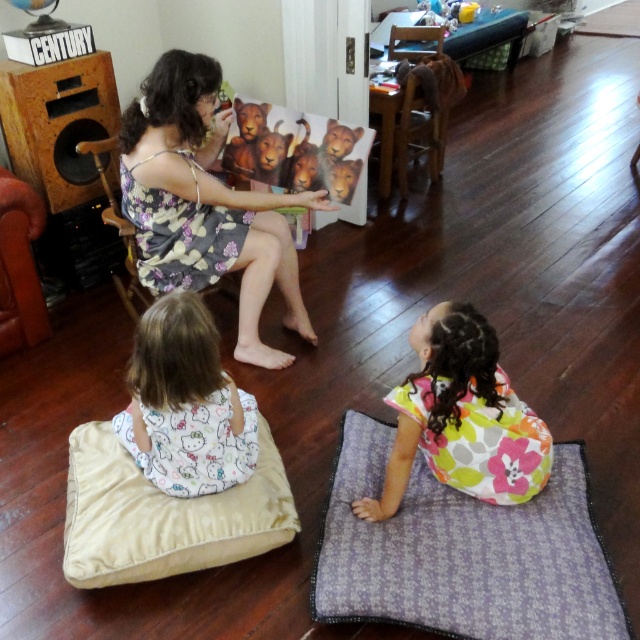
Which is in front, point (513, 547) or point (244, 332)?

Point (513, 547)

Is purple fabric mat at lower right to the right of floral dress at upper center from the viewer's perspective?

Correct, you'll find purple fabric mat at lower right to the right of floral dress at upper center.

Where is `purple fabric mat at lower right`? purple fabric mat at lower right is located at coordinates (461, 552).

Is point (150, 493) positioned in front of point (461, 465)?

No.

In order to click on beige fabric pillow at lower left in this screenshot , I will do `click(163, 515)`.

Which is in front, point (164, 116) or point (195, 516)?

Point (195, 516) is in front.

Is point (291, 193) more distant than point (272, 440)?

Yes, point (291, 193) is farther from viewer.

Who is more forward, (289, 273) or (273, 497)?

Point (273, 497) is in front.

I want to click on floral dress at upper center, so pos(204,204).